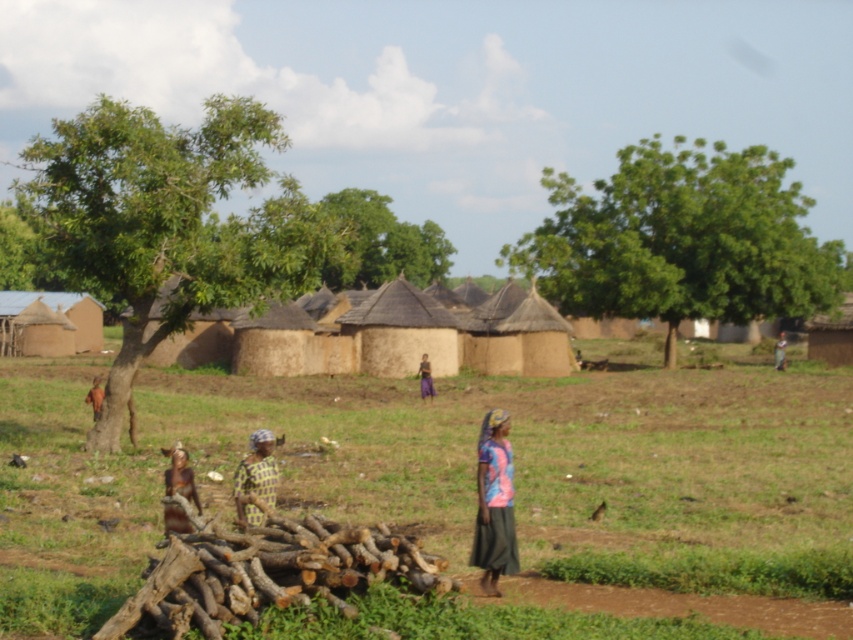
You are standing at the center of the image and see the brown textured person at left and the light brown wooden stick at center. Which object is closer to your current position?

The light brown wooden stick at center is closer to your current position because it is located at the center, while the brown textured person at left is positioned to the left of it.

Looking at this image, you are a visitor in the village and want to find the tallest object between the brown textured person at left and the light brown wooden stick at center. Which one is taller?

The light brown wooden stick at center is taller than the brown textured person at left.

You are standing at the origin point in the image and want to reach the point at the bottom right corner. Which of the two points, point (15, 570) or point (274, 596), is closer to your starting position?

Point (15, 570) is closer to the origin point than point (274, 596) because it has a smaller distance in coordinate terms.